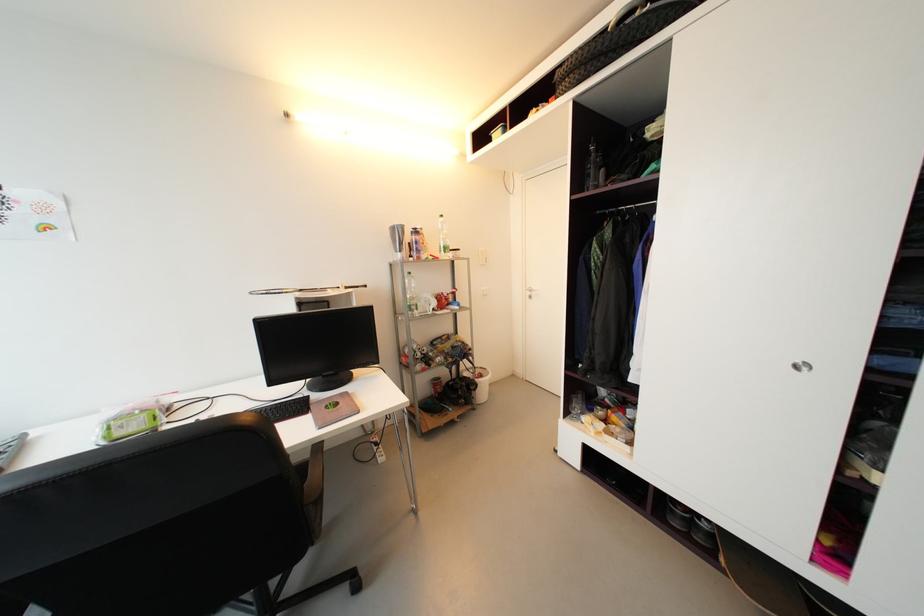
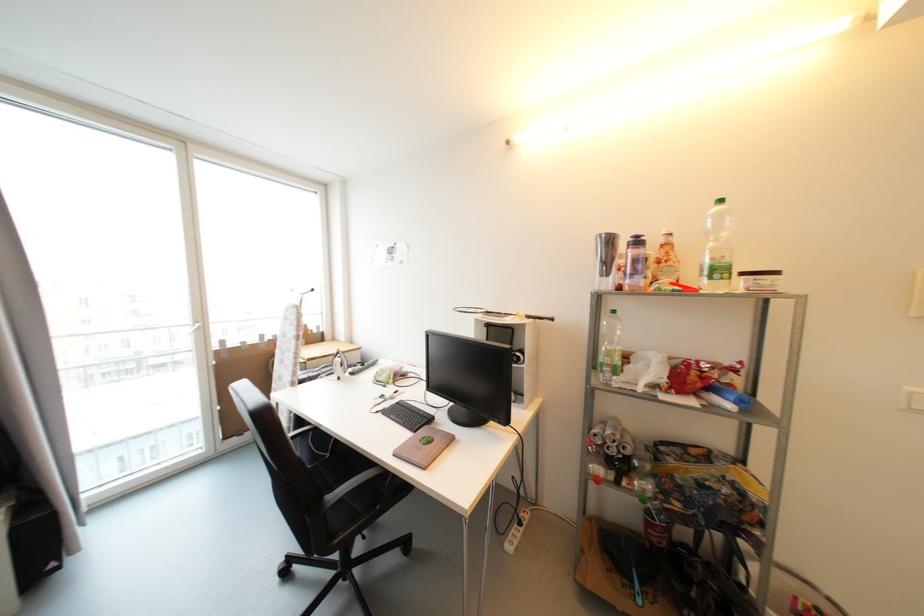
In the second image, find the point that corresponds to (304,410) in the first image.

(396, 426)